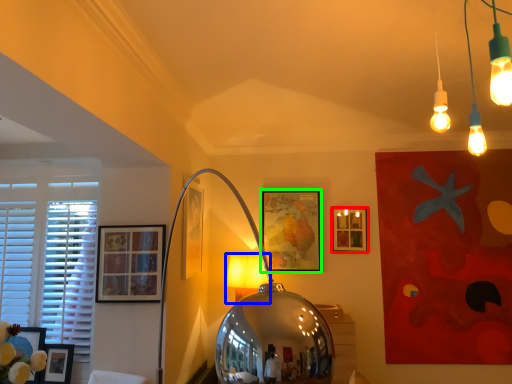
Question: Which object is positioned closest to picture frame (highlighted by a red box)? Select from table lamp (highlighted by a blue box) and picture frame (highlighted by a green box).

Choices:
 (A) table lamp
 (B) picture frame

Answer: (B)